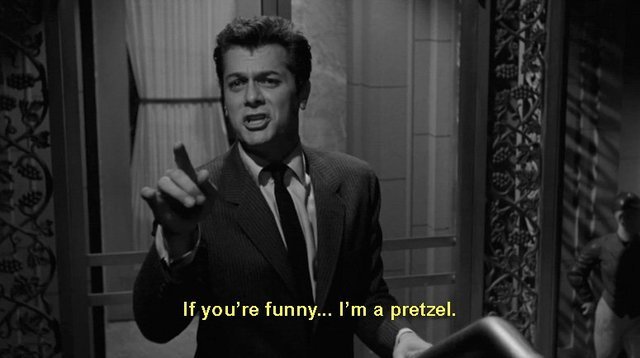
Where is `wall`? wall is located at coordinates (376, 93).